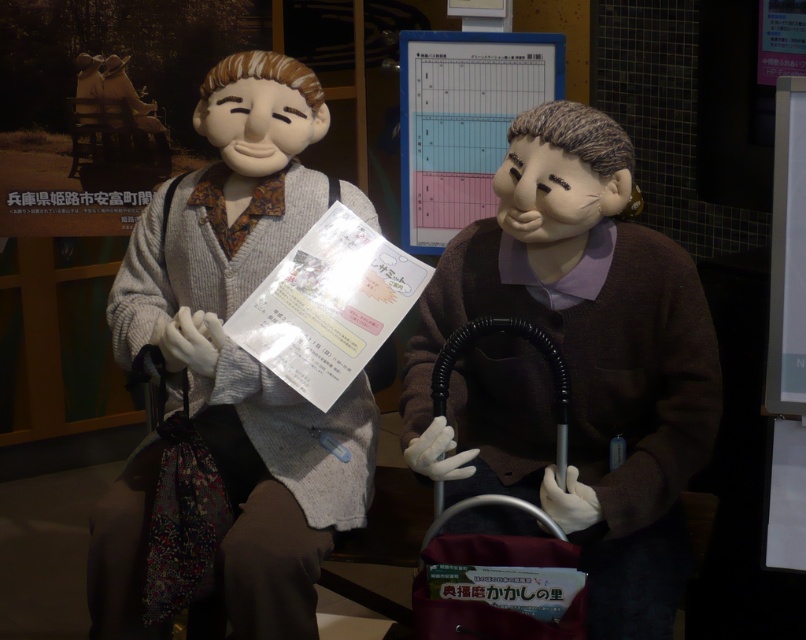
Question: Which point appears farthest from the camera in this image?

Choices:
 (A) (510, 384)
 (B) (302, 536)
 (C) (609, 336)

Answer: (A)

Question: Considering the real-world distances, which object is closest to the matte gray sweater at left?

Choices:
 (A) black rubber baby carriage at lower center
 (B) brown matte sweater at center
 (C) matte gray sweater at center

Answer: (C)

Question: Observing the image, what is the correct spatial positioning of matte gray sweater at center in reference to matte gray sweater at left?

Choices:
 (A) above
 (B) below

Answer: (A)

Question: Can you confirm if matte gray sweater at center is smaller than brown matte sweater at center?

Choices:
 (A) no
 (B) yes

Answer: (A)

Question: Which point is farther to the camera?

Choices:
 (A) (281, 444)
 (B) (455, 444)

Answer: (A)

Question: Does matte gray sweater at center appear on the left side of brown matte sweater at center?

Choices:
 (A) no
 (B) yes

Answer: (B)